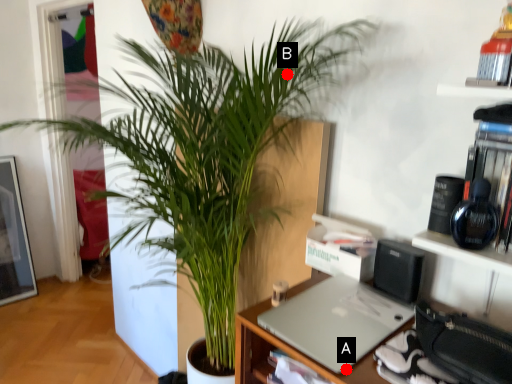
Question: Two points are circled on the image, labeled by A and B beside each circle. Which point appears closest to the camera in this image?

Choices:
 (A) A is closer
 (B) B is closer

Answer: (A)